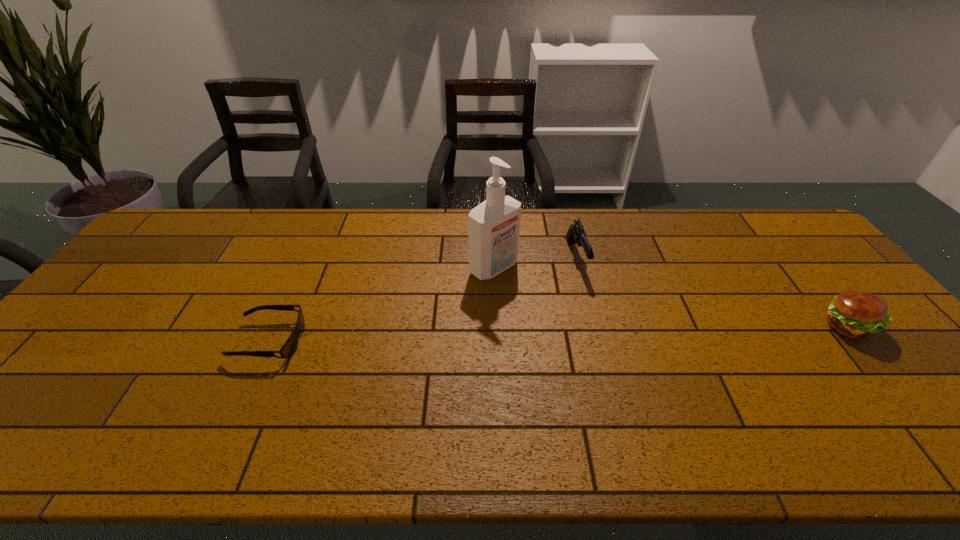
Locate an element on the screen. This screenshot has height=540, width=960. Lego that is positioned at the far edge is located at coordinates (485, 197).

At what (x,y) coordinates should I click in order to perform the action: click on object at the right edge. Please return your answer as a coordinate pair (x, y). Image resolution: width=960 pixels, height=540 pixels. Looking at the image, I should click on (856, 314).

I want to click on blank space at the far edge, so click(x=253, y=244).

Locate an element on the screen. This screenshot has width=960, height=540. vacant space at the near edge of the desktop is located at coordinates (744, 398).

Locate an element on the screen. Image resolution: width=960 pixels, height=540 pixels. vacant space at the left edge is located at coordinates (162, 286).

At what (x,y) coordinates should I click in order to perform the action: click on free space at the right edge of the desktop. Please return your answer as a coordinate pair (x, y). The height and width of the screenshot is (540, 960). Looking at the image, I should click on (811, 257).

Find the location of a particular element. free space at the far left corner is located at coordinates (192, 251).

Find the location of `empty location between the rightmost object and the farthest object`. empty location between the rightmost object and the farthest object is located at coordinates (671, 272).

In order to click on free spot between the tallest object and the rightmost object in this screenshot , I will do `click(670, 298)`.

Identify the location of vacant area between the Lego and the rightmost object. (671, 272).